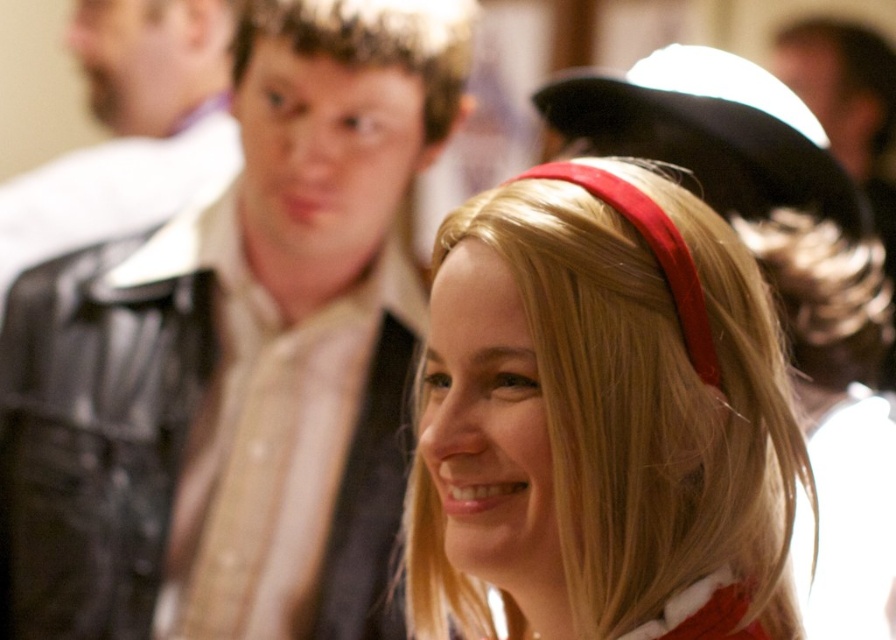
Question: Can you confirm if matte red headband at center is wider than leather jacket at left?

Choices:
 (A) no
 (B) yes

Answer: (A)

Question: Which point is farther to the camera?

Choices:
 (A) leather jacket at left
 (B) leather jacket at upper left

Answer: (A)

Question: Is matte red headband at center to the right of leather jacket at left from the viewer's perspective?

Choices:
 (A) yes
 (B) no

Answer: (A)

Question: Which point appears closest to the camera in this image?

Choices:
 (A) (x=623, y=228)
 (B) (x=399, y=444)

Answer: (A)

Question: Is leather jacket at upper left further to the viewer compared to leather jacket at left?

Choices:
 (A) yes
 (B) no

Answer: (B)

Question: Which of the following is the farthest from the observer?

Choices:
 (A) (566, 573)
 (B) (128, 33)
 (C) (314, 124)

Answer: (B)